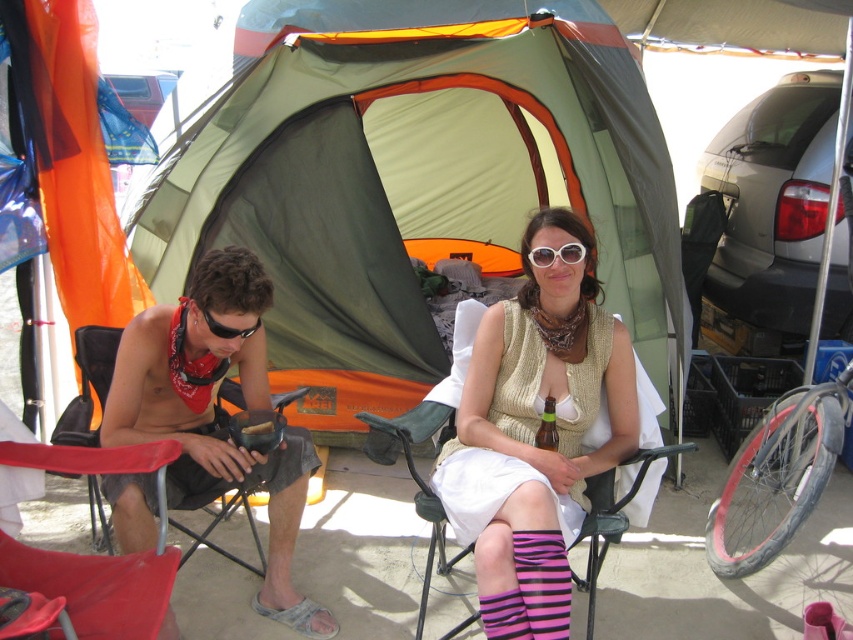
Question: Does white knitted vest at center appear over matte red folding chair at lower left?

Choices:
 (A) yes
 (B) no

Answer: (A)

Question: Observing the image, what is the correct spatial positioning of green canvas tent at center in reference to white knitted vest at center?

Choices:
 (A) below
 (B) above

Answer: (B)

Question: Which of the following is the farthest from the observer?

Choices:
 (A) (204, 458)
 (B) (207, 317)
 (C) (144, 582)
 (D) (527, 428)

Answer: (D)

Question: Which object is the closest to the red plastic chair at left?

Choices:
 (A) matte red folding chair at lower left
 (B) black rubber sunglasses at left
 (C) white knitted vest at center

Answer: (A)

Question: Is red plastic chair at left below matte red bikini top at left?

Choices:
 (A) yes
 (B) no

Answer: (A)

Question: Which object is closer to the camera taking this photo?

Choices:
 (A) green canvas tent at center
 (B) black rubber sunglasses at left

Answer: (B)